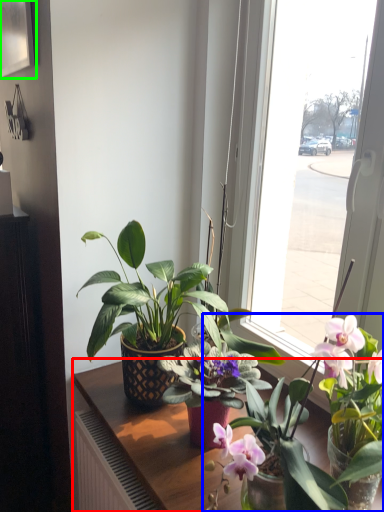
Question: Which object is the farthest from table (highlighted by a red box)? Choose among these: houseplant (highlighted by a blue box) or picture frame (highlighted by a green box).

Choices:
 (A) houseplant
 (B) picture frame

Answer: (B)